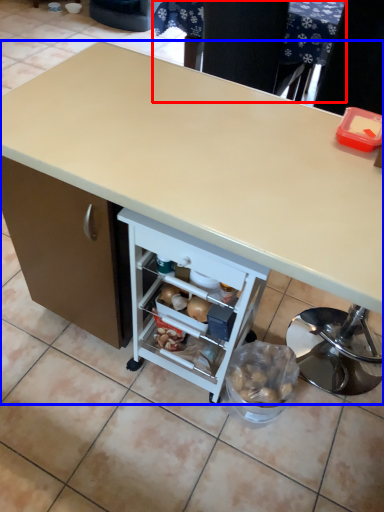
Question: Which object is closer to the camera taking this photo, table (highlighted by a red box) or desk (highlighted by a blue box)?

Choices:
 (A) table
 (B) desk

Answer: (B)